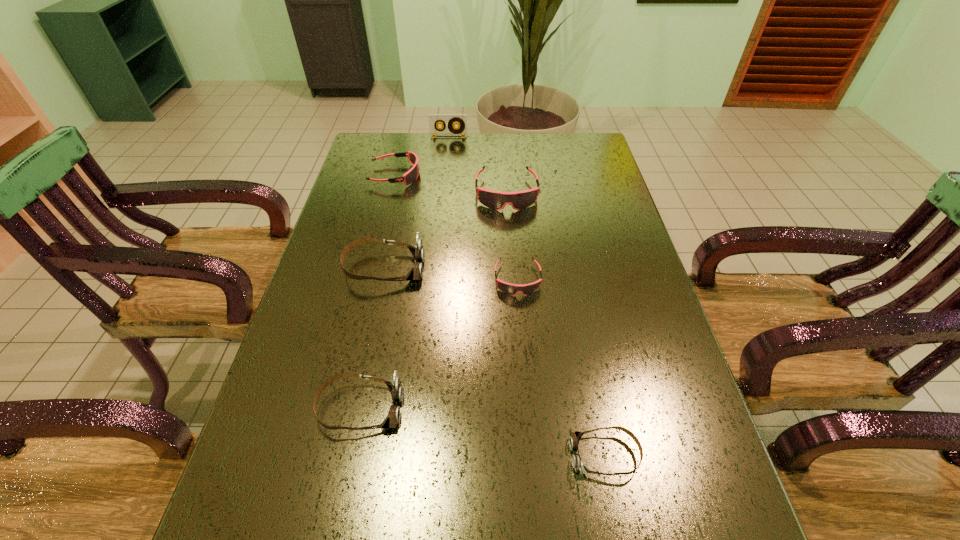
The height and width of the screenshot is (540, 960). Find the location of `the tallest object`. the tallest object is located at coordinates (434, 119).

The image size is (960, 540). Find the location of `brown videotape`. brown videotape is located at coordinates (434, 119).

Identify the location of the biggest pink goggles. The image size is (960, 540). (495, 200).

The image size is (960, 540). Identify the location of the farthest brown goggles. (416, 273).

You are a GUI agent. You are given a task and a screenshot of the screen. Output one action in this format:
    pyautogui.click(x=<x>, y=<y>)
    Task: Click on the leftmost pink goggles
    
    Given the screenshot: What is the action you would take?
    coord(411,176)

You are a GUI agent. You are given a task and a screenshot of the screen. Output one action in this format:
    pyautogui.click(x=<x>, y=<y>)
    Task: Click on the second biggest brown goggles
    Image resolution: width=960 pixels, height=540 pixels.
    Given the screenshot: What is the action you would take?
    pyautogui.click(x=395, y=385)

Locate an element on the screen. This screenshot has height=540, width=960. the smallest pink goggles is located at coordinates (511, 289).

Find the location of a particular element. The image size is (960, 540). the smallest brown goggles is located at coordinates (575, 437).

The width and height of the screenshot is (960, 540). I want to click on free space located at the front of the videotape with visible reels, so click(x=443, y=201).

This screenshot has width=960, height=540. In order to click on vacant point located on the front-facing side of the biggest pink goggles in this screenshot , I will do `click(510, 244)`.